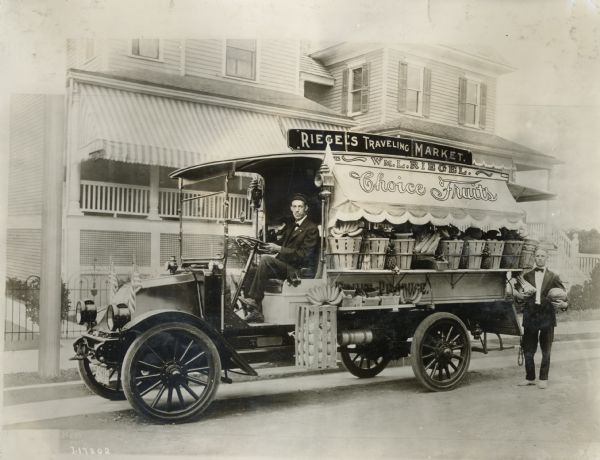
I want to click on fruit baskets, so click(x=343, y=249), click(x=380, y=243), click(x=403, y=246), click(x=457, y=251), click(x=480, y=248), click(x=499, y=250), click(x=516, y=250), click(x=526, y=250).